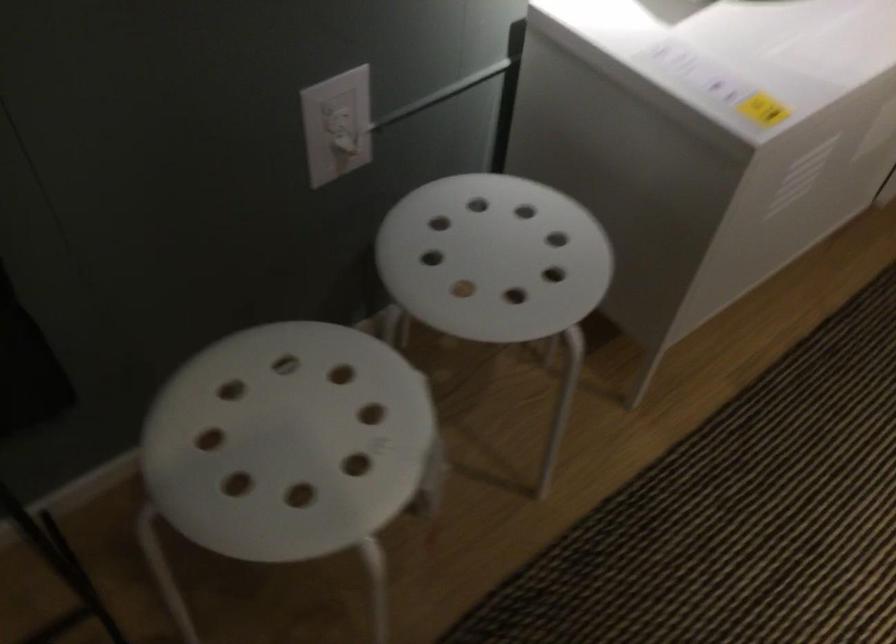
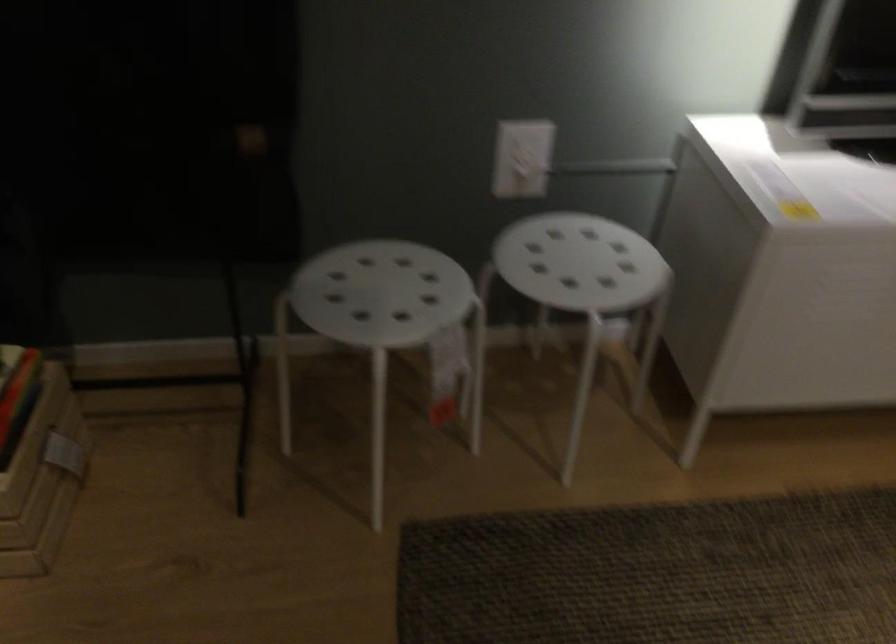
Question: The camera is either moving clockwise (left) or counter-clockwise (right) around the object. The first image is from the beginning of the video and the second image is from the end. Is the camera moving left or right when shooting the video?

Choices:
 (A) Left
 (B) Right

Answer: (B)